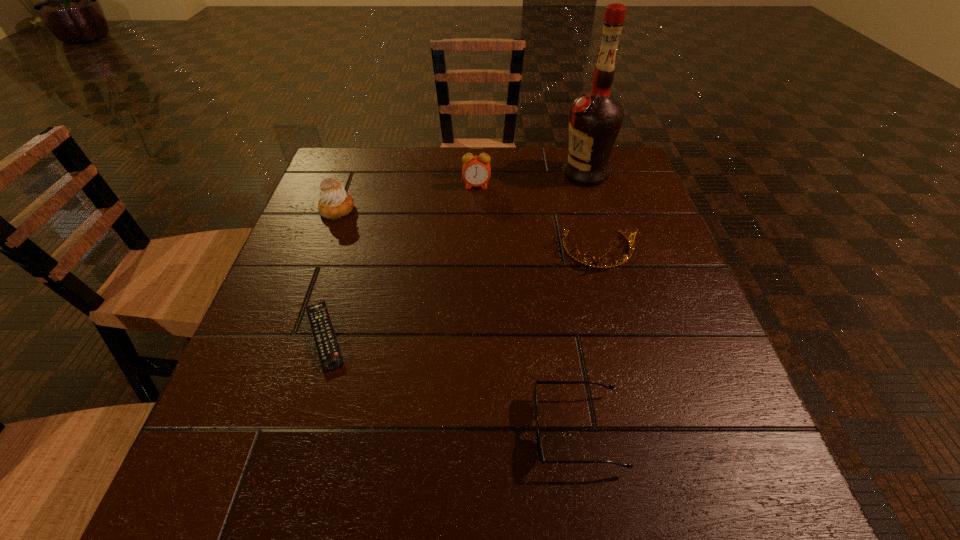
Find the location of a particular element. This screenshot has width=960, height=540. vacant space located 0.080m on the front and back of the tallest object is located at coordinates (532, 173).

Identify the location of vacant area located on the front and back of the tallest object. This screenshot has height=540, width=960. (414, 173).

Where is `free point located 0.200m on the front and back of the tallest object`? This screenshot has height=540, width=960. free point located 0.200m on the front and back of the tallest object is located at coordinates (487, 173).

The height and width of the screenshot is (540, 960). What are the coordinates of `vacant space located 0.050m on the face of the alarm clock` in the screenshot? It's located at (476, 201).

Where is `vacant area located 0.100m on the front of the third farthest object`? Image resolution: width=960 pixels, height=540 pixels. vacant area located 0.100m on the front of the third farthest object is located at coordinates (323, 248).

This screenshot has width=960, height=540. Identify the location of free point located on the front-facing side of the fourth farthest object. (609, 289).

I want to click on free space located 0.300m on the front lenses of the nearest object, so click(x=343, y=431).

Image resolution: width=960 pixels, height=540 pixels. What are the coordinates of `free space located 0.320m on the front lenses of the nearest object` in the screenshot? It's located at (330, 431).

Image resolution: width=960 pixels, height=540 pixels. Identify the location of blank space located 0.250m on the front lenses of the nearest object. (375, 431).

You are a GUI agent. You are given a task and a screenshot of the screen. Output one action in this format:
    pyautogui.click(x=<x>, y=<y>)
    Task: Click on the free space located 0.160m on the right of the fifth farthest object
    This screenshot has width=960, height=540.
    Given the screenshot: What is the action you would take?
    pyautogui.click(x=438, y=336)